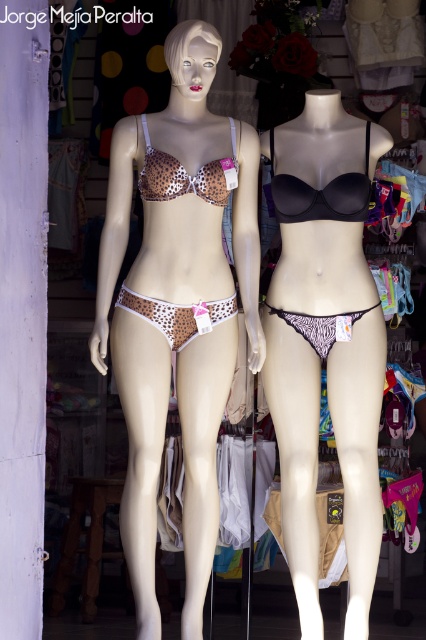
Is point (152, 524) positioned after point (229, 184)?

No, (152, 524) is closer to viewer.

Is leopard print fabric bikini at left closer to the viewer compared to leopard print fabric bikini top at center?

Yes, leopard print fabric bikini at left is in front of leopard print fabric bikini top at center.

Is point (115, 248) farther from viewer compared to point (224, 196)?

No, (115, 248) is closer to viewer.

Identify the location of leopard print fabric bikini at left. (178, 305).

Does matte black bikini at center have a smaller size compared to leopard print fabric bikini at center?

Actually, matte black bikini at center might be larger than leopard print fabric bikini at center.

Does matte black bikini at center have a larger size compared to leopard print fabric bikini at center?

Indeed, matte black bikini at center has a larger size compared to leopard print fabric bikini at center.

Between point (321, 202) and point (230, 308), which one is positioned behind?

Positioned behind is point (321, 202).

This screenshot has width=426, height=640. Identify the location of matte black bikini at center. (325, 340).

Which is more to the right, matte black bikini at center or leopard print fabric bikini top at center?

matte black bikini at center is more to the right.

Is matte black bikini at center further to the viewer compared to leopard print fabric bikini top at center?

No.

Image resolution: width=426 pixels, height=640 pixels. Describe the element at coordinates (325, 340) in the screenshot. I see `matte black bikini at center` at that location.

Find the location of a particular element. Image resolution: width=426 pixels, height=640 pixels. matte black bikini at center is located at coordinates (325, 340).